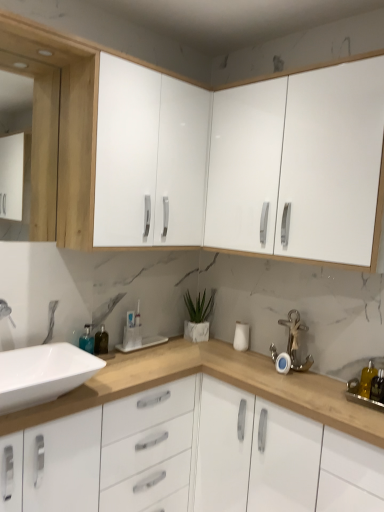
The width and height of the screenshot is (384, 512). I want to click on white glossy cabinet at upper left, the 3th cabinetry positioned from the bottom, so click(x=148, y=156).

What are the coordinates of `silver metallic tap at left` in the screenshot? It's located at click(x=6, y=311).

The width and height of the screenshot is (384, 512). What are the coordinates of `yellow translucent soap dispenser at right` in the screenshot? It's located at (367, 380).

How much space does white glossy cabinet at center, acting as the third cabinetry starting from the top, occupy vertically?

33.36 inches.

Identify the location of matte wood medicine cabinet at left. (44, 153).

Is point (218, 210) more distant than point (306, 370)?

Yes, point (218, 210) is farther from viewer.

Would you say white glossy cabinet at upper right, positioned as the 2th cabinetry in top-to-bottom order, is inside or outside silver metallic anchor at lower right?

white glossy cabinet at upper right, positioned as the 2th cabinetry in top-to-bottom order, lies outside silver metallic anchor at lower right.

Looking at the image, does white glossy cabinet at upper right, the 2th cabinetry positioned from the bottom, seem bigger or smaller compared to silver metallic anchor at lower right?

In the image, white glossy cabinet at upper right, the 2th cabinetry positioned from the bottom, appears to be larger than silver metallic anchor at lower right.

Who is shorter, white glossy cabinet at upper right, positioned as the 2th cabinetry in top-to-bottom order, or silver metallic anchor at lower right?

Standing shorter between the two is silver metallic anchor at lower right.

In the scene shown: Between silver metallic anchor at lower right and silver metallic tap at left, which one has smaller size?

Smaller between the two is silver metallic tap at left.

Is point (301, 329) farther from camera compared to point (4, 309)?

Yes, point (301, 329) is behind point (4, 309).

From a real-world perspective, is silver metallic anchor at lower right on top of silver metallic tap at left?

No, from a real-world perspective, silver metallic anchor at lower right is not on top of silver metallic tap at left.

Is silver metallic anchor at lower right inside or outside of silver metallic tap at left?

silver metallic anchor at lower right is outside silver metallic tap at left.

Can you tell me how much white glossy cabinet at upper left, arranged as the first cabinetry when viewed from the top, and white glossy cabinet at upper right, the 2th cabinetry positioned from the bottom, differ in facing direction?

The facing directions of white glossy cabinet at upper left, arranged as the first cabinetry when viewed from the top, and white glossy cabinet at upper right, the 2th cabinetry positioned from the bottom, are 90 degrees apart.

From a real-world perspective, is white glossy cabinet at upper left, arranged as the first cabinetry when viewed from the top, physically located above or below white glossy cabinet at upper right, positioned as the 2th cabinetry in top-to-bottom order?

From a real-world perspective, white glossy cabinet at upper left, arranged as the first cabinetry when viewed from the top, is physically above white glossy cabinet at upper right, positioned as the 2th cabinetry in top-to-bottom order.

Is white glossy cabinet at upper left, arranged as the first cabinetry when viewed from the top, further to the viewer compared to white glossy cabinet at upper right, the 2th cabinetry positioned from the bottom?

Yes, white glossy cabinet at upper left, arranged as the first cabinetry when viewed from the top, is further from the viewer.

Considering the relative sizes of white glossy cabinet at upper left, the 3th cabinetry positioned from the bottom, and white glossy cabinet at upper right, positioned as the 2th cabinetry in top-to-bottom order, in the image provided, is white glossy cabinet at upper left, the 3th cabinetry positioned from the bottom, taller than white glossy cabinet at upper right, positioned as the 2th cabinetry in top-to-bottom order,?

Yes.

Is point (367, 384) closer or farther from the camera than point (33, 373)?

Point (367, 384) is farther from the camera than point (33, 373).

Which of these two, yellow translucent soap dispenser at right or white glossy sink at lower left, stands shorter?

Standing shorter between the two is white glossy sink at lower left.

Consider the image. Measure the distance between yellow translucent soap dispenser at right and white glossy sink at lower left.

3.79 feet.

Is yellow translucent soap dispenser at right aimed at white glossy sink at lower left?

No, yellow translucent soap dispenser at right is not turned towards white glossy sink at lower left.

Does matte wood medicine cabinet at left have a greater width compared to white glossy cabinet at upper right, positioned as the 2th cabinetry in top-to-bottom order?

No.

From a real-world perspective, who is located lower, matte wood medicine cabinet at left or white glossy cabinet at upper right, positioned as the 2th cabinetry in top-to-bottom order?

matte wood medicine cabinet at left, from a real-world perspective.

Measure the distance from matte wood medicine cabinet at left to white glossy cabinet at upper right, the 2th cabinetry positioned from the bottom.

A distance of 35.10 inches exists between matte wood medicine cabinet at left and white glossy cabinet at upper right, the 2th cabinetry positioned from the bottom.

Looking at this image, is matte wood medicine cabinet at left at the left side of white glossy cabinet at upper right, the 2th cabinetry positioned from the bottom?

Yes.

Considering the relative sizes of white glossy sink at lower left and translucent plastic bottle at lower right in the image provided, is white glossy sink at lower left smaller than translucent plastic bottle at lower right?

Incorrect, white glossy sink at lower left is not smaller in size than translucent plastic bottle at lower right.

Between point (75, 383) and point (375, 389), which one is positioned in front?

The point (75, 383) is closer.

Is white glossy sink at lower left spatially inside translucent plastic bottle at lower right, or outside of it?

white glossy sink at lower left is not enclosed by translucent plastic bottle at lower right.

From the picture: Which object is closer to the camera, yellow translucent soap dispenser at right or white glossy cabinet at center, the 1th cabinetry in the bottom-to-top sequence?

white glossy cabinet at center, the 1th cabinetry in the bottom-to-top sequence, is closer to the camera.

You are a GUI agent. You are given a task and a screenshot of the screen. Output one action in this format:
    pyautogui.click(x=<x>, y=<y>)
    Task: Click on the soap dispenser above the white glossy cabinet at center, the 1th cabinetry in the bottom-to-top sequence (from a real-world perspective)
    The height and width of the screenshot is (512, 384).
    Given the screenshot: What is the action you would take?
    pyautogui.click(x=367, y=380)

Considering the sizes of objects yellow translucent soap dispenser at right and white glossy cabinet at center, acting as the third cabinetry starting from the top, in the image provided, who is wider, yellow translucent soap dispenser at right or white glossy cabinet at center, acting as the third cabinetry starting from the top,?

white glossy cabinet at center, acting as the third cabinetry starting from the top, is wider.

Which object is positioned more to the left, yellow translucent soap dispenser at right or white glossy cabinet at center, the 1th cabinetry in the bottom-to-top sequence?

white glossy cabinet at center, the 1th cabinetry in the bottom-to-top sequence.

There is a silver metallic anchor at lower right. Identify the location of the 1st cabinetry above it (from the image's perspective). This screenshot has width=384, height=512. (301, 164).

You are a GUI agent. You are given a task and a screenshot of the screen. Output one action in this format:
    pyautogui.click(x=<x>, y=<y>)
    Task: Click on the faucet below the silver metallic tap at left (from the image's perspective)
    This screenshot has height=512, width=384.
    Given the screenshot: What is the action you would take?
    pyautogui.click(x=295, y=340)

Which object lies further to the anchor point translucent amber bottle at lower left, white glossy cabinet at center, acting as the third cabinetry starting from the top, or white glossy cabinet at upper left, the 3th cabinetry positioned from the bottom?

The object further to translucent amber bottle at lower left is white glossy cabinet at upper left, the 3th cabinetry positioned from the bottom.

Looking at the image, which one is located further to white marble planter at center, white glossy cabinet at center, the 1th cabinetry in the bottom-to-top sequence, or yellow translucent soap dispenser at right?

Based on the image, yellow translucent soap dispenser at right appears to be further to white marble planter at center.

When comparing their distances from matte wood medicine cabinet at left, does translucent plastic bottle at lower right or translucent amber bottle at lower left seem further?

translucent plastic bottle at lower right is positioned further to the anchor matte wood medicine cabinet at left.

Based on their spatial positions, is white glossy cabinet at upper left, the 3th cabinetry positioned from the bottom, or translucent amber bottle at lower left closer to matte wood medicine cabinet at left?

The object closer to matte wood medicine cabinet at left is white glossy cabinet at upper left, the 3th cabinetry positioned from the bottom.

Looking at the image, which one is located closer to white marble planter at center, matte wood medicine cabinet at left or silver metallic anchor at lower right?

Among the two, silver metallic anchor at lower right is located nearer to white marble planter at center.

Which object lies nearer to the anchor point white glossy cabinet at upper left, the 3th cabinetry positioned from the bottom, translucent plastic bottle at lower right or silver metallic tap at left?

The object closer to white glossy cabinet at upper left, the 3th cabinetry positioned from the bottom, is silver metallic tap at left.

Looking at the image, which one is located closer to white marble planter at center, translucent amber bottle at lower left or yellow translucent soap dispenser at right?

Among the two, translucent amber bottle at lower left is located nearer to white marble planter at center.

Based on their spatial positions, is white glossy sink at lower left or translucent plastic bottle at lower right closer to white glossy cabinet at center, the 1th cabinetry in the bottom-to-top sequence?

translucent plastic bottle at lower right.

Identify the location of faucet between white glossy cabinet at upper left, the 3th cabinetry positioned from the bottom, and translucent amber bottle at lower left, in the vertical direction. Image resolution: width=384 pixels, height=512 pixels. (295, 340).

Where is `cabinetry between white glossy cabinet at upper left, the 3th cabinetry positioned from the bottom, and white glossy cabinet at center, the 1th cabinetry in the bottom-to-top sequence, in the up-down direction`? This screenshot has width=384, height=512. cabinetry between white glossy cabinet at upper left, the 3th cabinetry positioned from the bottom, and white glossy cabinet at center, the 1th cabinetry in the bottom-to-top sequence, in the up-down direction is located at coordinates (301, 164).

Find the location of a particular element. plant located between matte wood medicine cabinet at left and silver metallic anchor at lower right in the left-right direction is located at coordinates (198, 307).

Where is `sink situated between silver metallic tap at left and silver metallic anchor at lower right from left to right`? sink situated between silver metallic tap at left and silver metallic anchor at lower right from left to right is located at coordinates [42, 374].